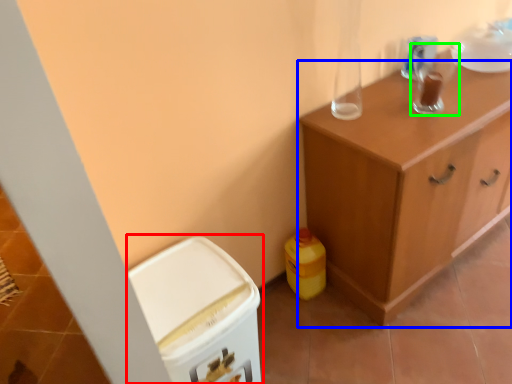
Question: Based on their relative distances, which object is farther from cabinetry (highlighted by a red box)? Choose from cabinetry (highlighted by a blue box) and appliance (highlighted by a green box).

Choices:
 (A) cabinetry
 (B) appliance

Answer: (B)